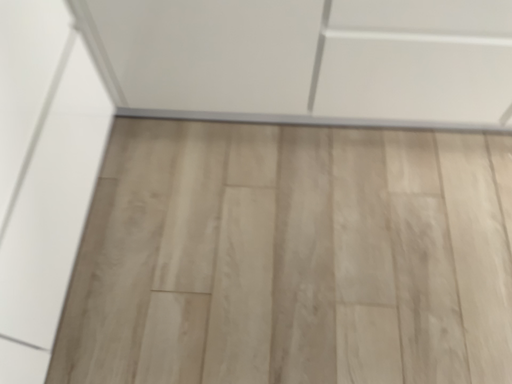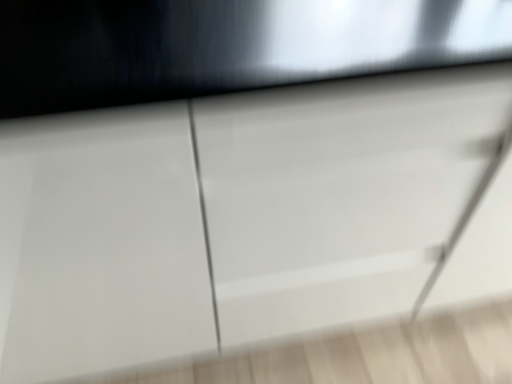
Question: How did the camera likely rotate when shooting the video?

Choices:
 (A) rotated upward
 (B) rotated downward

Answer: (A)